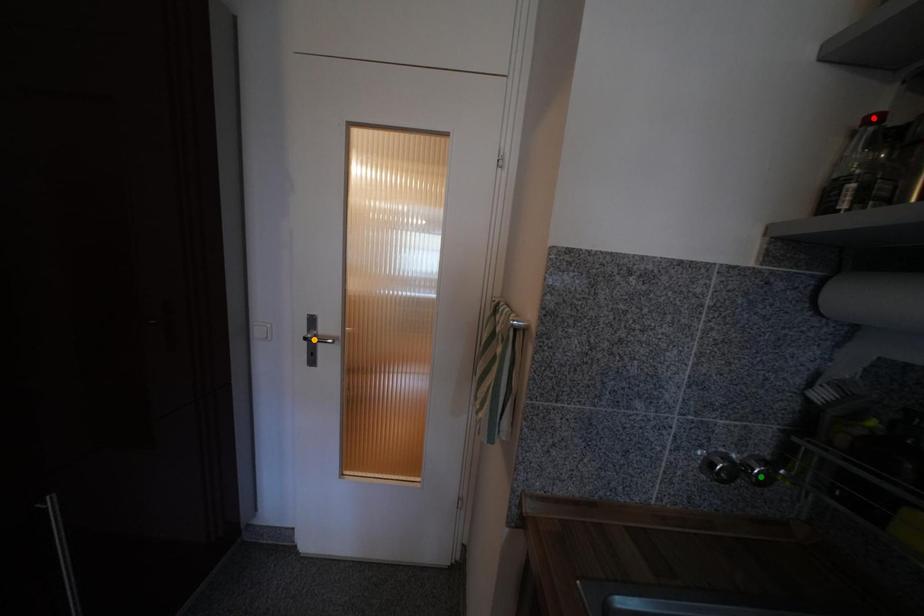
Order these from nearest to farthest:
orange point, green point, red point

red point
green point
orange point